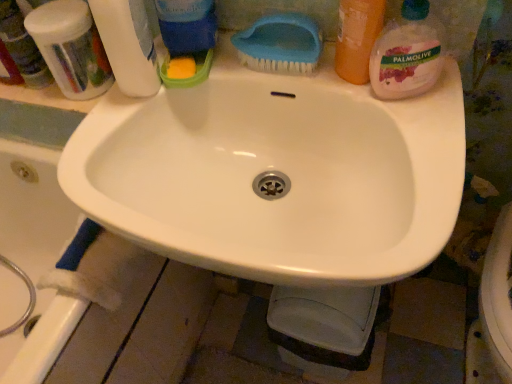
Where is `free space in front of translucent orange soap at upper right, which ranks as the 3th cleaning product in left-to-right order`? Image resolution: width=512 pixels, height=384 pixels. free space in front of translucent orange soap at upper right, which ranks as the 3th cleaning product in left-to-right order is located at coordinates (404, 133).